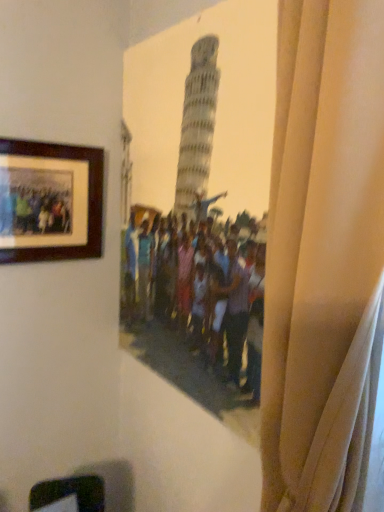
What do you see at coordinates (324, 257) in the screenshot? I see `beige fabric curtain at right` at bounding box center [324, 257].

The height and width of the screenshot is (512, 384). Identify the location of beige fabric curtain at right. coord(324,257).

What is the approximate width of beige fabric curtain at right?

8.33 inches.

Find the location of `wooden picture frame at upper left`. wooden picture frame at upper left is located at coordinates (77, 201).

The image size is (384, 512). Describe the element at coordinates (77, 201) in the screenshot. I see `wooden picture frame at upper left` at that location.

Locate an element on the screen. beige fabric curtain at right is located at coordinates (324, 257).

Can you confirm if wooden picture frame at upper left is positioned to the left of beige fabric curtain at right?

Indeed, wooden picture frame at upper left is positioned on the left side of beige fabric curtain at right.

Based on the photo, does wooden picture frame at upper left lie behind beige fabric curtain at right?

Yes.

Which is farther, (x=66, y=186) or (x=313, y=23)?

The point (x=66, y=186) is farther.

From the picture: From the image's perspective, is wooden picture frame at upper left over beige fabric curtain at right?

Correct, wooden picture frame at upper left appears higher than beige fabric curtain at right in the image.

From a real-world perspective, who is located lower, wooden picture frame at upper left or beige fabric curtain at right?

beige fabric curtain at right is physically lower.

Looking at their sizes, would you say wooden picture frame at upper left is wider or thinner than beige fabric curtain at right?

Clearly, wooden picture frame at upper left has less width compared to beige fabric curtain at right.

Is wooden picture frame at upper left taller or shorter than beige fabric curtain at right?

Clearly, wooden picture frame at upper left is shorter compared to beige fabric curtain at right.

Considering the relative sizes of wooden picture frame at upper left and beige fabric curtain at right in the image provided, is wooden picture frame at upper left smaller than beige fabric curtain at right?

Yes, wooden picture frame at upper left is smaller than beige fabric curtain at right.

Which is correct: wooden picture frame at upper left is inside beige fabric curtain at right, or outside of it?

wooden picture frame at upper left is not enclosed by beige fabric curtain at right.

Is wooden picture frame at upper left touching beige fabric curtain at right?

wooden picture frame at upper left and beige fabric curtain at right are not in contact.

Is wooden picture frame at upper left facing away from beige fabric curtain at right?

No, beige fabric curtain at right is not at the back of wooden picture frame at upper left.

Can you tell me how much wooden picture frame at upper left and beige fabric curtain at right differ in facing direction?

88.3 degrees.

Locate an element on the screen. curtain below the wooden picture frame at upper left (from a real-world perspective) is located at coordinates (324, 257).

Between beige fabric curtain at right and wooden picture frame at upper left, which one appears on the left side from the viewer's perspective?

wooden picture frame at upper left.

In the scene shown: Which object is closer to the camera taking this photo, beige fabric curtain at right or wooden picture frame at upper left?

Positioned in front is beige fabric curtain at right.

Does point (288, 286) lie behind point (62, 205)?

That is False.

From the image's perspective, relative to wooden picture frame at upper left, is beige fabric curtain at right above or below?

Clearly, from the image's perspective, beige fabric curtain at right is below wooden picture frame at upper left.

From a real-world perspective, which object rests below the other?

beige fabric curtain at right.

Considering the sizes of beige fabric curtain at right and wooden picture frame at upper left in the image, is beige fabric curtain at right wider or thinner than wooden picture frame at upper left?

beige fabric curtain at right is wider than wooden picture frame at upper left.

Is beige fabric curtain at right shorter than wooden picture frame at upper left?

Incorrect, the height of beige fabric curtain at right does not fall short of that of wooden picture frame at upper left.

Does beige fabric curtain at right have a smaller size compared to wooden picture frame at upper left?

Incorrect, beige fabric curtain at right is not smaller in size than wooden picture frame at upper left.

Is wooden picture frame at upper left surrounded by beige fabric curtain at right?

No, beige fabric curtain at right does not contain wooden picture frame at upper left.

Is beige fabric curtain at right far away from wooden picture frame at upper left?

They are positioned close to each other.

Is beige fabric curtain at right turned away from wooden picture frame at upper left?

No, beige fabric curtain at right's orientation is not away from wooden picture frame at upper left.

How different are the orientations of beige fabric curtain at right and wooden picture frame at upper left in degrees?

beige fabric curtain at right and wooden picture frame at upper left are facing 88.3 degrees away from each other.

Where is `curtain on the right of wooden picture frame at upper left`? The width and height of the screenshot is (384, 512). curtain on the right of wooden picture frame at upper left is located at coordinates click(324, 257).

Where is `picture frame on the left of the beige fabric curtain at right`? picture frame on the left of the beige fabric curtain at right is located at coordinates (77, 201).

At what (x,y) coordinates should I click in order to perform the action: click on picture frame positioned vertically above the beige fabric curtain at right (from a real-world perspective). Please return your answer as a coordinate pair (x, y). This screenshot has width=384, height=512. Looking at the image, I should click on (77, 201).